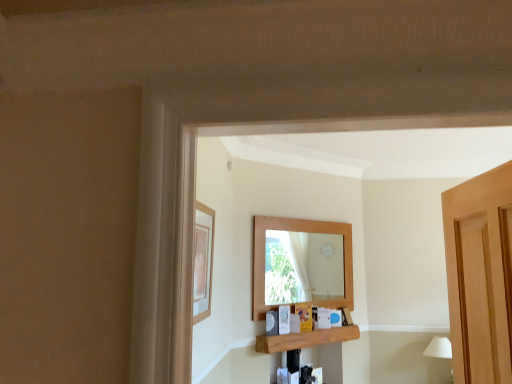
Question: Does white matte lampshade at lower right have a smaller size compared to matte wooden picture frame at upper left?

Choices:
 (A) yes
 (B) no

Answer: (B)

Question: Does white matte lampshade at lower right appear on the left side of matte wooden picture frame at upper left?

Choices:
 (A) yes
 (B) no

Answer: (B)

Question: Does white matte lampshade at lower right have a lesser height compared to matte wooden picture frame at upper left?

Choices:
 (A) no
 (B) yes

Answer: (B)

Question: Does white matte lampshade at lower right come in front of matte wooden picture frame at upper left?

Choices:
 (A) yes
 (B) no

Answer: (B)

Question: Considering the relative sizes of white matte lampshade at lower right and matte wooden picture frame at upper left in the image provided, is white matte lampshade at lower right taller than matte wooden picture frame at upper left?

Choices:
 (A) no
 (B) yes

Answer: (A)

Question: From a real-world perspective, is white matte lampshade at lower right located beneath matte wooden picture frame at upper left?

Choices:
 (A) no
 (B) yes

Answer: (B)

Question: Is wooden shelf at center positioned in front of matte wooden picture frame at upper left?

Choices:
 (A) no
 (B) yes

Answer: (A)

Question: Is wooden shelf at center at the left side of matte wooden picture frame at upper left?

Choices:
 (A) yes
 (B) no

Answer: (B)

Question: From the image's perspective, is wooden shelf at center over matte wooden picture frame at upper left?

Choices:
 (A) yes
 (B) no

Answer: (B)

Question: Is wooden shelf at center smaller than matte wooden picture frame at upper left?

Choices:
 (A) no
 (B) yes

Answer: (A)

Question: Is the position of wooden shelf at center more distant than that of matte wooden picture frame at upper left?

Choices:
 (A) yes
 (B) no

Answer: (A)

Question: Is the surface of wooden shelf at center in direct contact with matte wooden picture frame at upper left?

Choices:
 (A) no
 (B) yes

Answer: (A)

Question: Is matte wooden picture frame at upper left further to camera compared to wooden shelf at center?

Choices:
 (A) no
 (B) yes

Answer: (A)